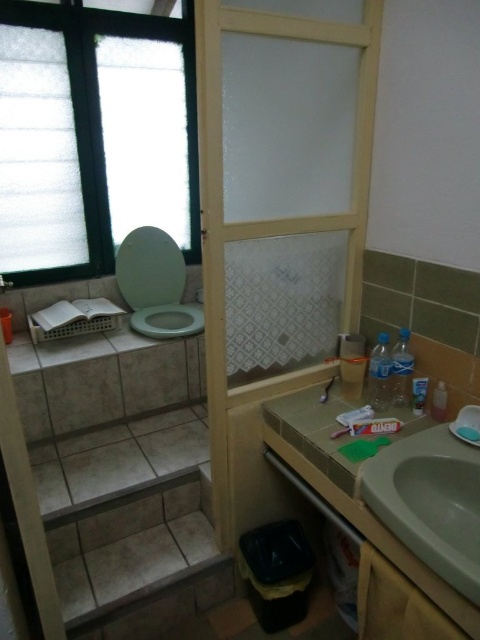
Is point (202, 132) closer to viewer compared to point (420, 397)?

Yes, it is.

Is translucent wood screen door at center above translucent plastic toothpaste tube at lower right?

Correct, translucent wood screen door at center is located above translucent plastic toothpaste tube at lower right.

Identify the location of translucent wood screen door at center. (277, 216).

Image resolution: width=480 pixels, height=640 pixels. I want to click on translucent wood screen door at center, so click(x=277, y=216).

Between point (357, 353) and point (422, 394), which one is positioned behind?

The point (357, 353) is more distant.

Who is shorter, translucent plastic toothbrush at center or translucent plastic toothpaste tube at lower right?

With less height is translucent plastic toothpaste tube at lower right.

Is point (340, 348) farther from camera compared to point (420, 406)?

Yes, it is behind point (420, 406).

Find the location of a particular element. This screenshot has width=480, height=640. translucent plastic toothbrush at center is located at coordinates (351, 364).

Can you confirm if translucent wood screen door at center is positioned to the left of green matte toilet at left?

No, translucent wood screen door at center is not to the left of green matte toilet at left.

Does point (204, 8) come in front of point (137, 285)?

Yes, point (204, 8) is in front of point (137, 285).

This screenshot has height=640, width=480. I want to click on translucent wood screen door at center, so click(x=277, y=216).